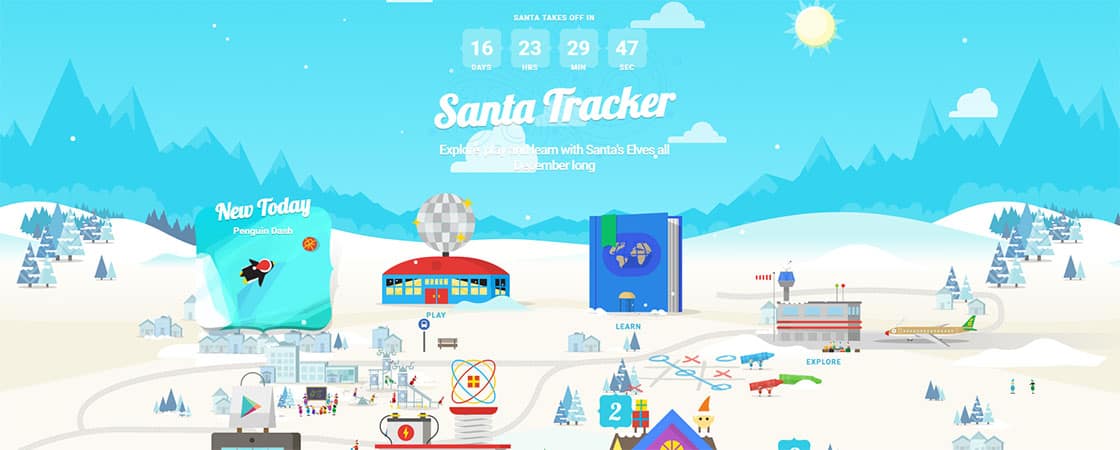
The image size is (1120, 450). Find the location of `disco ball`. disco ball is located at coordinates (439, 212).